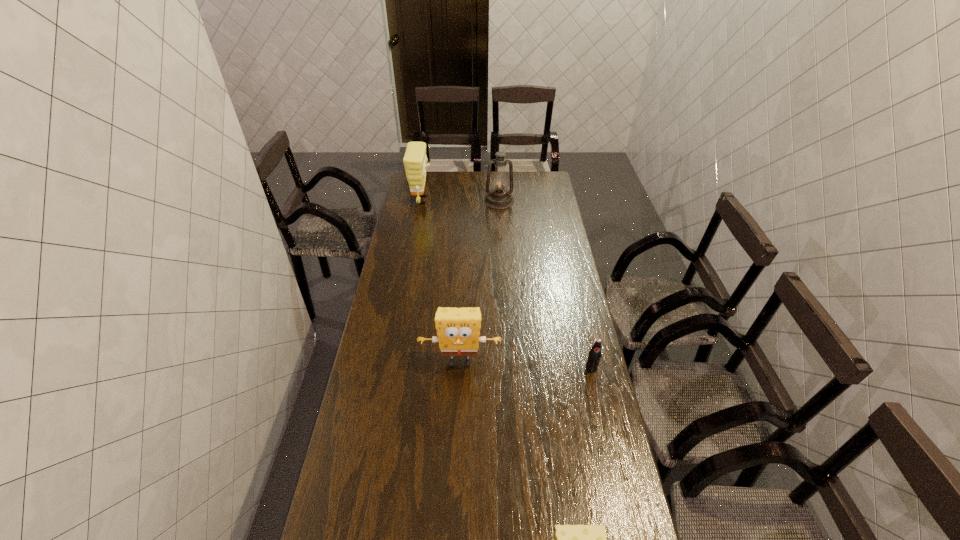
Identify the location of free point located on the front label of the rightmost object. (599, 402).

Where is `oil lamp at the far edge`? This screenshot has width=960, height=540. oil lamp at the far edge is located at coordinates (499, 198).

This screenshot has height=540, width=960. Identify the location of sponge present at the far edge. [415, 159].

This screenshot has width=960, height=540. Find the location of `object present at the left edge`. object present at the left edge is located at coordinates (415, 159).

Identify the location of object that is at the right edge. (594, 356).

Locate an element on the screen. object located in the far left corner section of the desktop is located at coordinates (415, 159).

Where is `free space at the left edge of the desktop`? This screenshot has height=540, width=960. free space at the left edge of the desktop is located at coordinates (413, 245).

Image resolution: width=960 pixels, height=540 pixels. In order to click on vacant space at the right edge of the desktop in this screenshot , I will do `click(599, 434)`.

Find the location of `free spot between the oil lamp and the shortest object`. free spot between the oil lamp and the shortest object is located at coordinates (545, 284).

Find the location of a particular element. blank region between the oil lamp and the leftmost object is located at coordinates (461, 200).